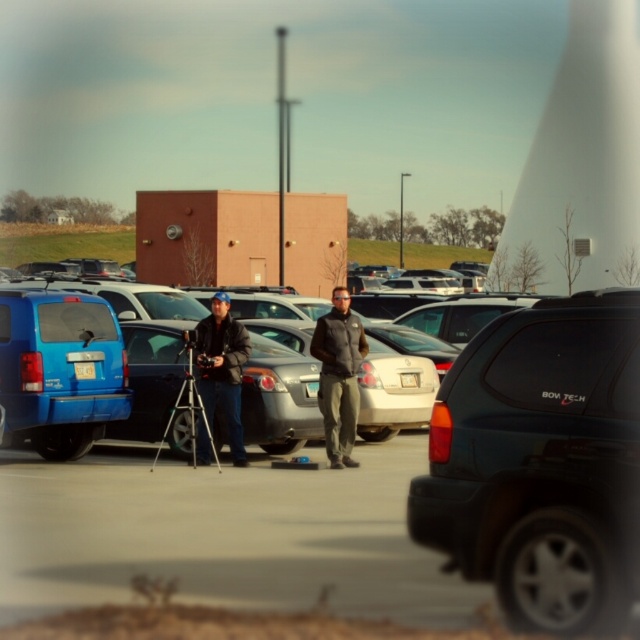
You are a photographer trying to capture a clear shot of the matte black suv at center. However, the dark gray fleece jacket at center is blocking part of your view. Can you adjust your position to avoid the jacket while still keeping the suv in frame?

The matte black suv at center is in front of the dark gray fleece jacket at center, so moving your position slightly backward would keep the suv in frame while avoiding the jacket.